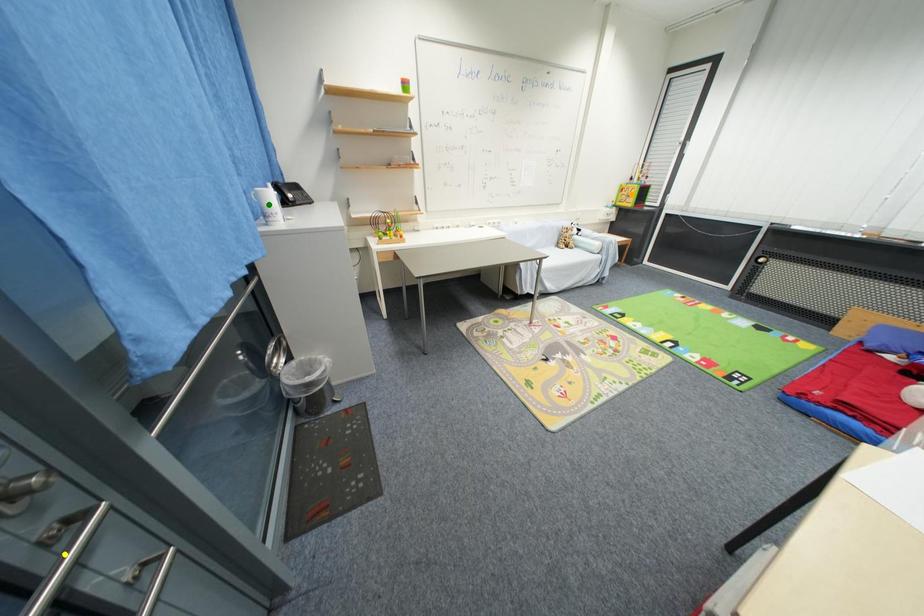
Order these from nearest to farthest:
orange point, yellow point, green point

yellow point, green point, orange point